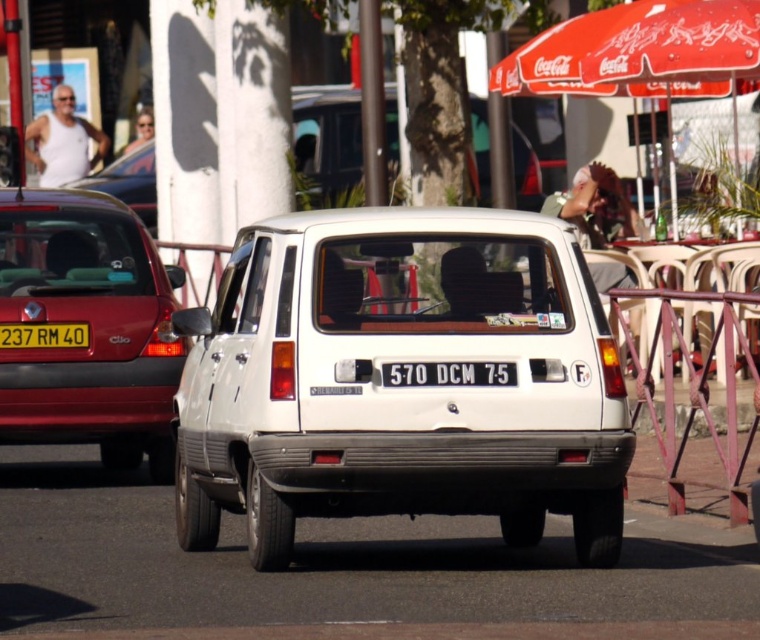
Question: Can you confirm if metallic red hatchback at left is bigger than red fabric umbrella at upper right?

Choices:
 (A) no
 (B) yes

Answer: (A)

Question: Is the position of metallic red hatchback at left more distant than that of black plastic license plate at center?

Choices:
 (A) no
 (B) yes

Answer: (B)

Question: Which is nearer to the white matte van at center?

Choices:
 (A) white matte hatchback at center
 (B) red fabric umbrella at upper right
 (C) metallic red hatchback at left
 (D) black plastic license plate at center

Answer: (D)

Question: Which object is the farthest from the white matte hatchback at center?

Choices:
 (A) black plastic license plate at center
 (B) white matte van at center
 (C) red fabric umbrella at upper right
 (D) yellow matte license plate at center

Answer: (A)

Question: Considering the relative positions of white matte hatchback at center and yellow matte license plate at center in the image provided, where is white matte hatchback at center located with respect to yellow matte license plate at center?

Choices:
 (A) left
 (B) right

Answer: (B)

Question: Among these points, which one is farthest from the camera?

Choices:
 (A) (51, 422)
 (B) (86, 333)

Answer: (B)